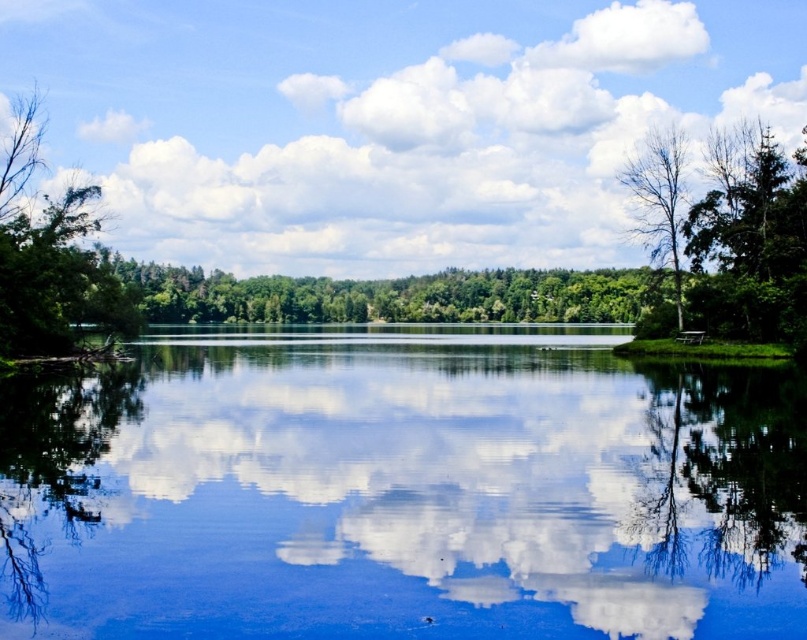
Does transparent glass water at center have a smaller size compared to white fluffy cloud at upper center?

Indeed, transparent glass water at center has a smaller size compared to white fluffy cloud at upper center.

Is point (356, 392) positioned before point (343, 67)?

Yes, it is.

Locate an element on the screen. transparent glass water at center is located at coordinates (400, 492).

Between green leafy forest at center and bare wood tree at right, which one is positioned higher?

Positioned higher is bare wood tree at right.

Which is in front, point (421, 314) or point (680, 173)?

Point (680, 173) is in front.

Is point (270, 292) in front of point (678, 237)?

No, (270, 292) is behind (678, 237).

This screenshot has width=807, height=640. Identify the location of green leafy forest at center. (394, 296).

Can you confirm if transparent glass tree at right is wider than bare wood tree at right?

Incorrect, transparent glass tree at right's width does not surpass bare wood tree at right's.

Can you confirm if transparent glass tree at right is taller than bare wood tree at right?

In fact, transparent glass tree at right may be shorter than bare wood tree at right.

Describe the element at coordinates (734, 454) in the screenshot. I see `transparent glass tree at right` at that location.

This screenshot has width=807, height=640. Identify the location of transparent glass tree at right. (734, 454).